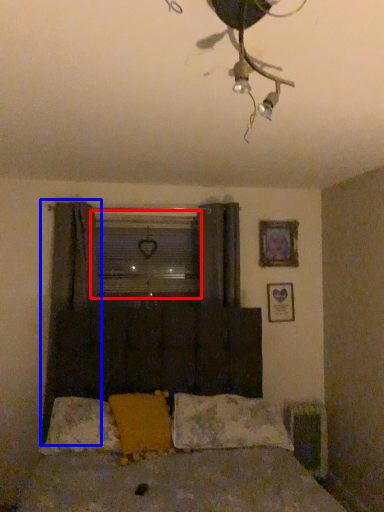
Question: Which object appears farthest to the camera in this image, window screen (highlighted by a red box) or curtain (highlighted by a blue box)?

Choices:
 (A) window screen
 (B) curtain

Answer: (A)